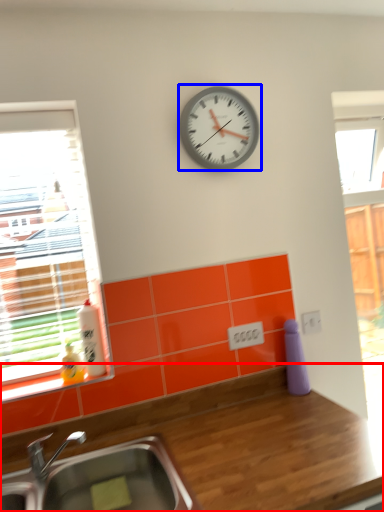
Question: Which object is further to the camera taking this photo, countertop (highlighted by a red box) or wall clock (highlighted by a blue box)?

Choices:
 (A) countertop
 (B) wall clock

Answer: (B)